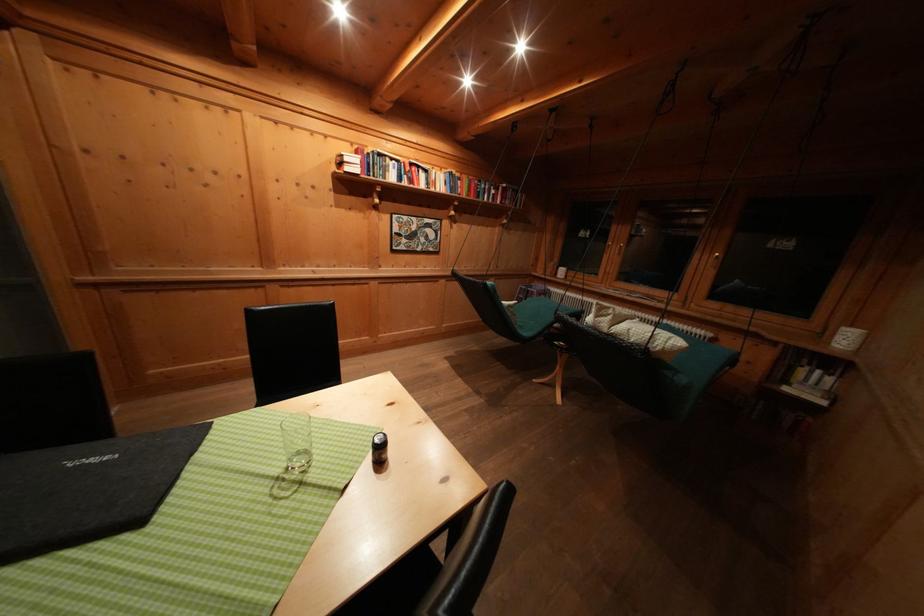
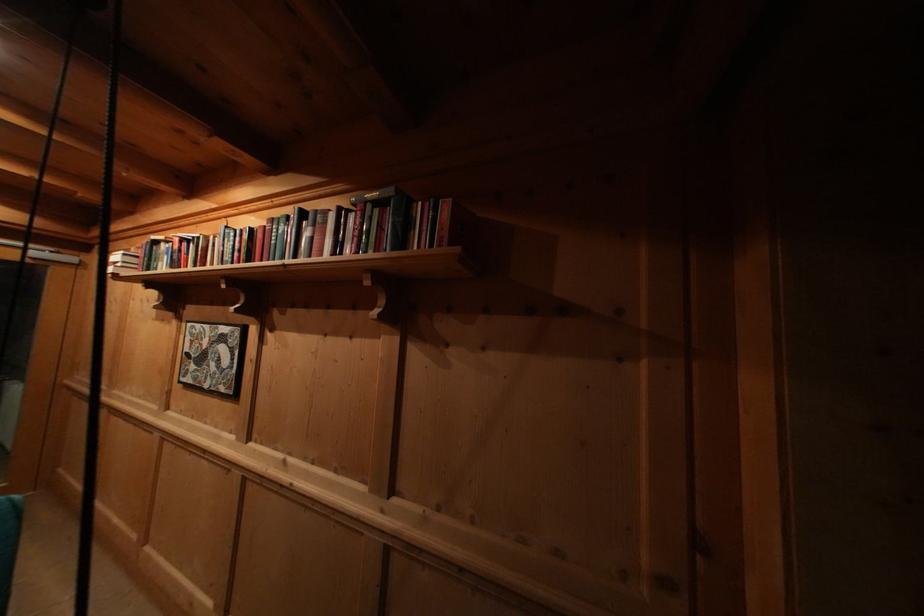
Where in the second image is the point corresponding to pixel 418 169 from the first image?

(188, 246)